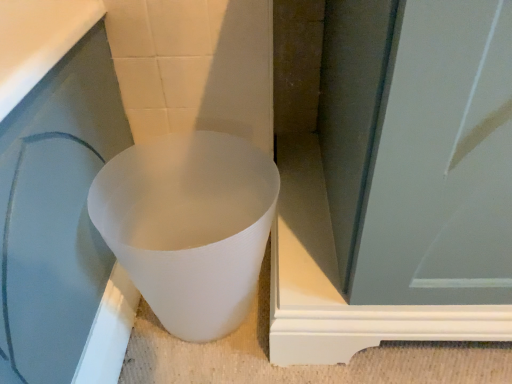
Question: Is white matte plastic cup at lower left further to camera compared to white matte screen door at center?

Choices:
 (A) no
 (B) yes

Answer: (B)

Question: Is white matte plastic cup at lower left facing away from white matte screen door at center?

Choices:
 (A) yes
 (B) no

Answer: (B)

Question: Does white matte plastic cup at lower left have a greater width compared to white matte screen door at center?

Choices:
 (A) no
 (B) yes

Answer: (A)

Question: Is white matte plastic cup at lower left positioned in front of white matte screen door at center?

Choices:
 (A) no
 (B) yes

Answer: (A)

Question: Can you confirm if white matte plastic cup at lower left is positioned to the left of white matte screen door at center?

Choices:
 (A) yes
 (B) no

Answer: (A)

Question: From the image's perspective, is white matte plastic cup at lower left located beneath white matte screen door at center?

Choices:
 (A) yes
 (B) no

Answer: (A)

Question: Can you confirm if white matte screen door at center is taller than white matte plastic cup at lower left?

Choices:
 (A) yes
 (B) no

Answer: (A)

Question: Is white matte screen door at center oriented towards white matte plastic cup at lower left?

Choices:
 (A) yes
 (B) no

Answer: (B)

Question: From the image's perspective, is white matte screen door at center located beneath white matte plastic cup at lower left?

Choices:
 (A) yes
 (B) no

Answer: (B)

Question: Is the depth of white matte screen door at center less than that of white matte plastic cup at lower left?

Choices:
 (A) yes
 (B) no

Answer: (A)

Question: Is white matte screen door at center not within white matte plastic cup at lower left?

Choices:
 (A) no
 (B) yes

Answer: (B)

Question: Is white matte screen door at center at the left side of white matte plastic cup at lower left?

Choices:
 (A) no
 (B) yes

Answer: (A)

Question: In terms of size, does white matte plastic cup at lower left appear bigger or smaller than white matte screen door at center?

Choices:
 (A) small
 (B) big

Answer: (A)